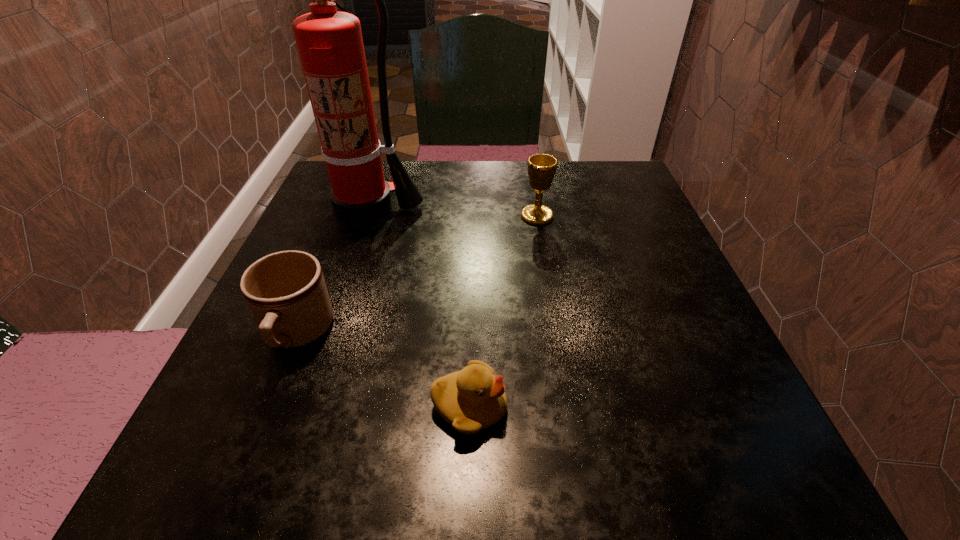
Image resolution: width=960 pixels, height=540 pixels. I want to click on free point between the duckling and the third farthest object, so click(x=383, y=370).

I want to click on free spot between the second shortest object and the chalice, so click(418, 275).

Choose which object is the nearest neighbor to the rightmost object. Please provide its 2D coordinates. Your answer should be formatted as a tuple, i.e. [(x, y)], where the tuple contains the x and y coordinates of a point satisfying the conditions above.

[(330, 45)]

Point out which object is positioned as the nearest to the chalice. Please provide its 2D coordinates. Your answer should be formatted as a tuple, i.e. [(x, y)], where the tuple contains the x and y coordinates of a point satisfying the conditions above.

[(330, 45)]

This screenshot has height=540, width=960. Find the location of `vacant space that satisfies the following two spatial constraints: 1. at the nozzle of the chalice; 2. on the right side of the tallest object`. vacant space that satisfies the following two spatial constraints: 1. at the nozzle of the chalice; 2. on the right side of the tallest object is located at coordinates (366, 216).

Where is `free region that satisfies the following two spatial constraints: 1. at the nozzle of the chalice; 2. on the left side of the tallest object`? Image resolution: width=960 pixels, height=540 pixels. free region that satisfies the following two spatial constraints: 1. at the nozzle of the chalice; 2. on the left side of the tallest object is located at coordinates (366, 216).